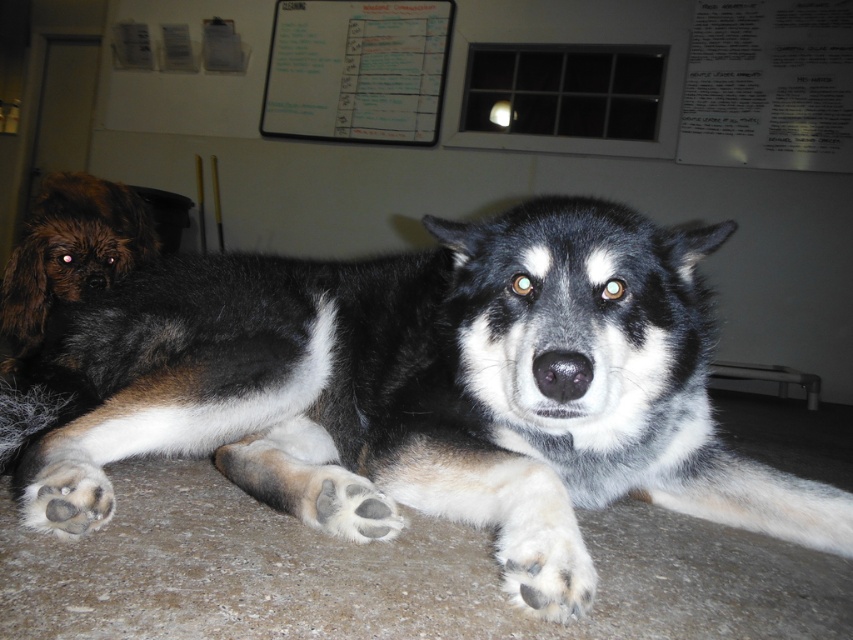
Question: Which is nearer to the fuzzy fur paw at lower center?

Choices:
 (A) brown fuzzy dog at left
 (B) white fur at lower center
 (C) gray concrete floor at center

Answer: (C)

Question: Among these objects, which one is nearest to the camera?

Choices:
 (A) white fur at lower center
 (B) fuzzy fur paw at lower left
 (C) black and white fur dog at center

Answer: (A)

Question: Can you confirm if white paperboard at upper center is positioned to the left of fuzzy fur paw at lower center?

Choices:
 (A) no
 (B) yes

Answer: (B)

Question: Is black and white fur dog at center smaller than fuzzy fur paw at lower left?

Choices:
 (A) no
 (B) yes

Answer: (A)

Question: Does fuzzy fur paw at lower left appear over fuzzy fur paw at lower center?

Choices:
 (A) yes
 (B) no

Answer: (A)

Question: Which of the following is the farthest from the observer?

Choices:
 (A) black and white fur dog at center
 (B) white fur at lower center
 (C) fuzzy fur paw at lower center

Answer: (C)